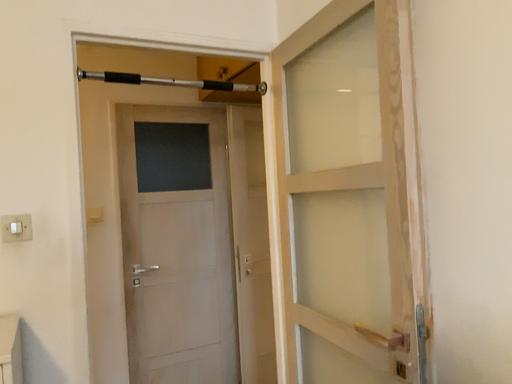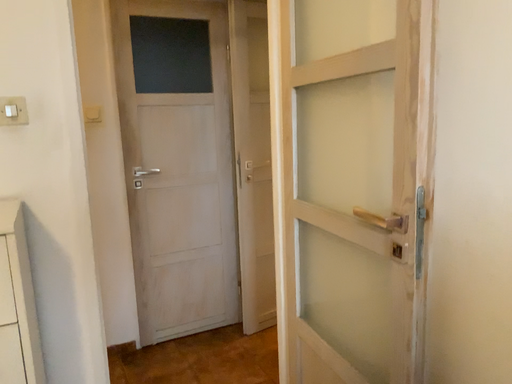
Question: How did the camera likely rotate when shooting the video?

Choices:
 (A) rotated upward
 (B) rotated downward

Answer: (B)